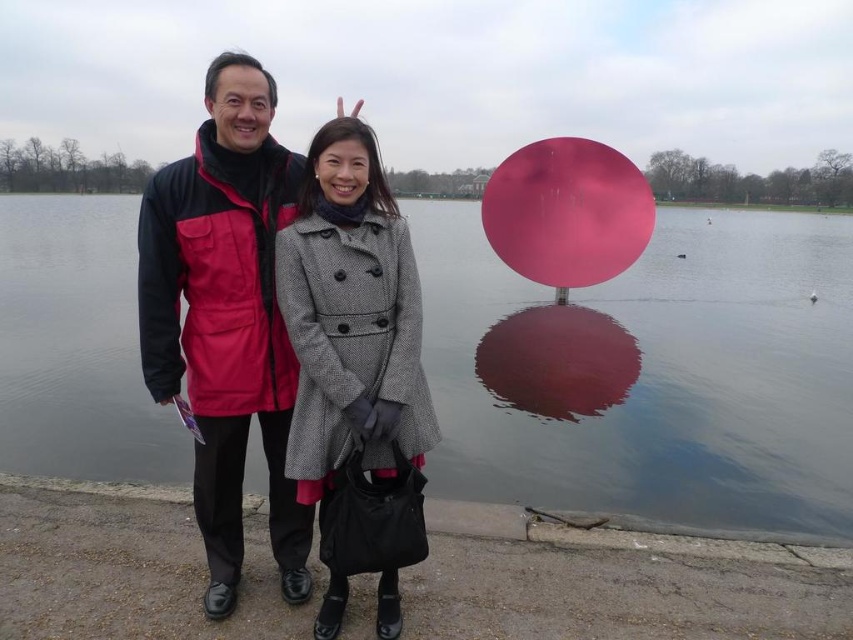
Question: Which object is closer to the camera taking this photo?

Choices:
 (A) pink glossy water at center
 (B) matte black jacket at center
 (C) gray wool coat at center

Answer: (C)

Question: Can you confirm if pink glossy water at center is positioned above matte black jacket at center?

Choices:
 (A) no
 (B) yes

Answer: (B)

Question: Which of these objects is positioned closest to the matte black jacket at center?

Choices:
 (A) gray wool coat at center
 (B) pink glossy water at center

Answer: (A)

Question: Does matte black jacket at center come in front of gray wool coat at center?

Choices:
 (A) yes
 (B) no

Answer: (B)

Question: Can you confirm if pink glossy water at center is positioned below matte black jacket at center?

Choices:
 (A) yes
 (B) no

Answer: (B)

Question: Which of these objects is positioned farthest from the pink glossy water at center?

Choices:
 (A) gray wool coat at center
 (B) matte black jacket at center

Answer: (B)